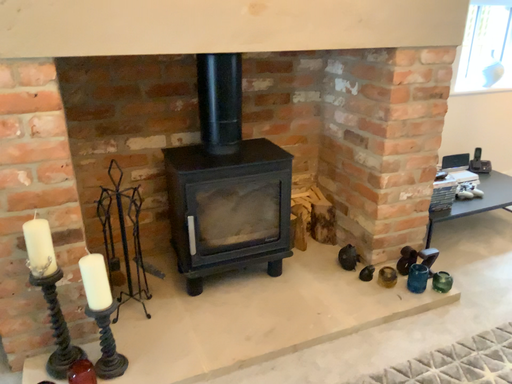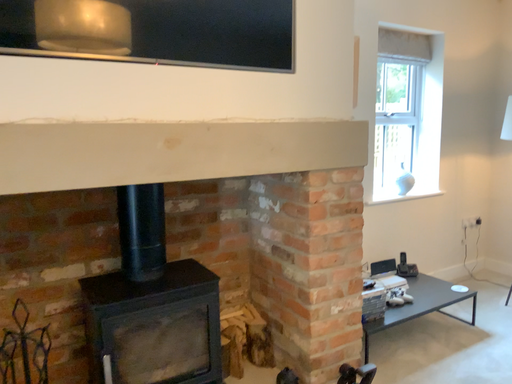
Question: How did the camera likely rotate when shooting the video?

Choices:
 (A) rotated left
 (B) rotated right

Answer: (B)